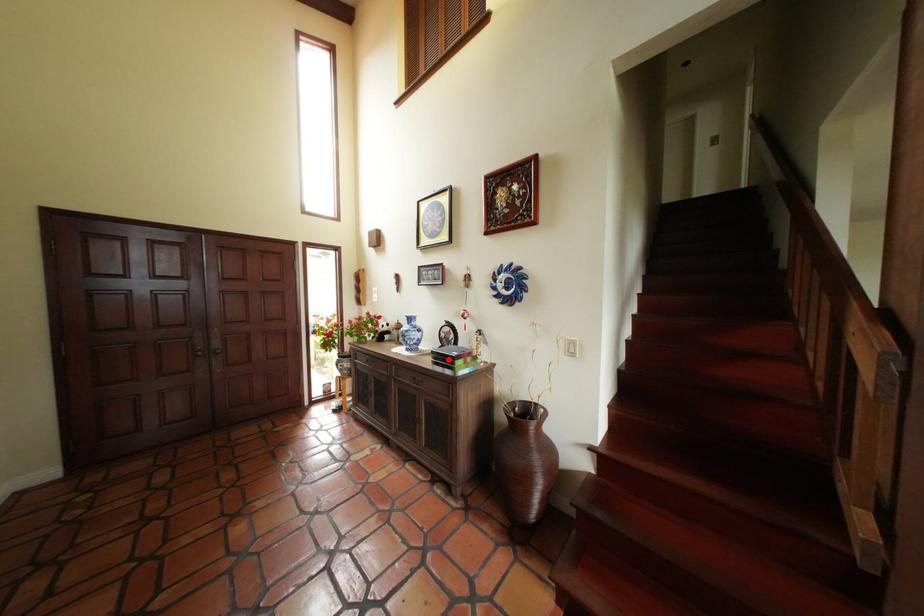
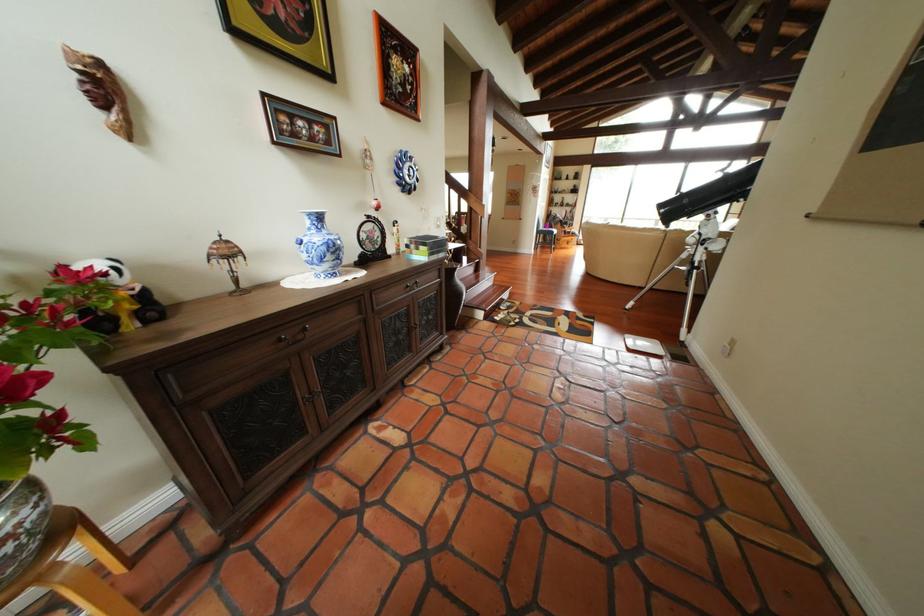
The point at the highlighted location is marked in the first image. Where is the corresponding point in the second image?

(444, 249)